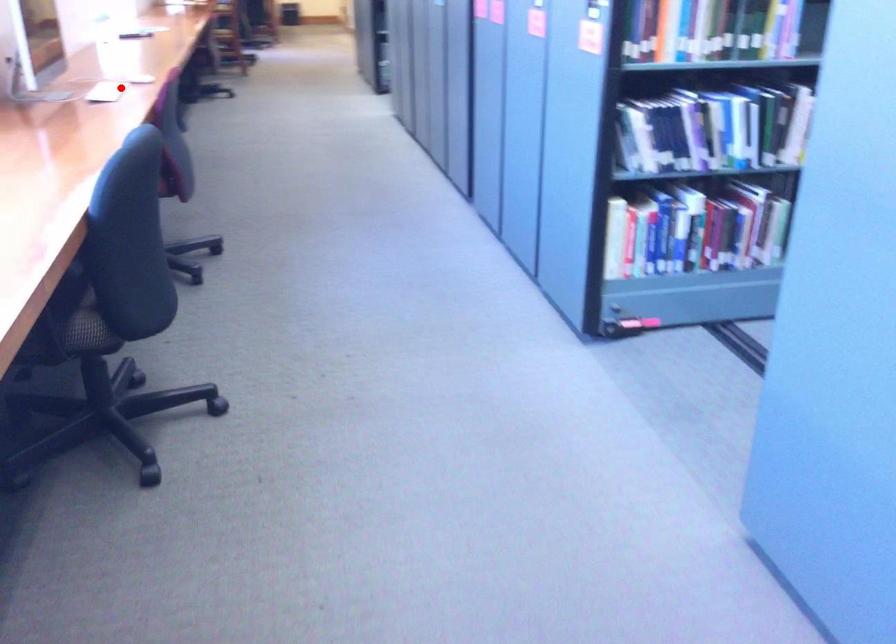
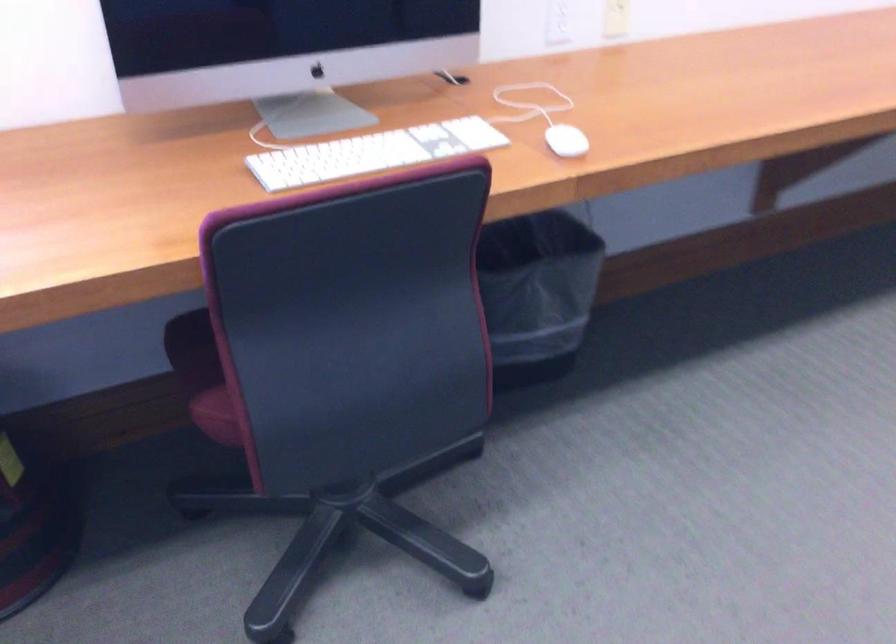
Question: A red point is marked in image1. In image2, is the corresponding 3D point closer to the camera or farther? Reply with the corresponding letter.

Choices:
 (A) The corresponding 3D point is closer.
 (B) The corresponding 3D point is farther.

Answer: (A)